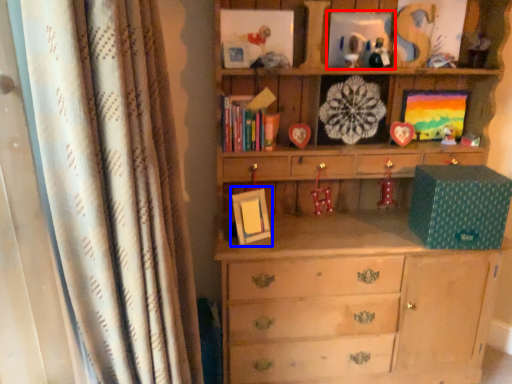
Question: Which object is further to the camera taking this photo, picture frame (highlighted by a red box) or picture frame (highlighted by a blue box)?

Choices:
 (A) picture frame
 (B) picture frame

Answer: (A)